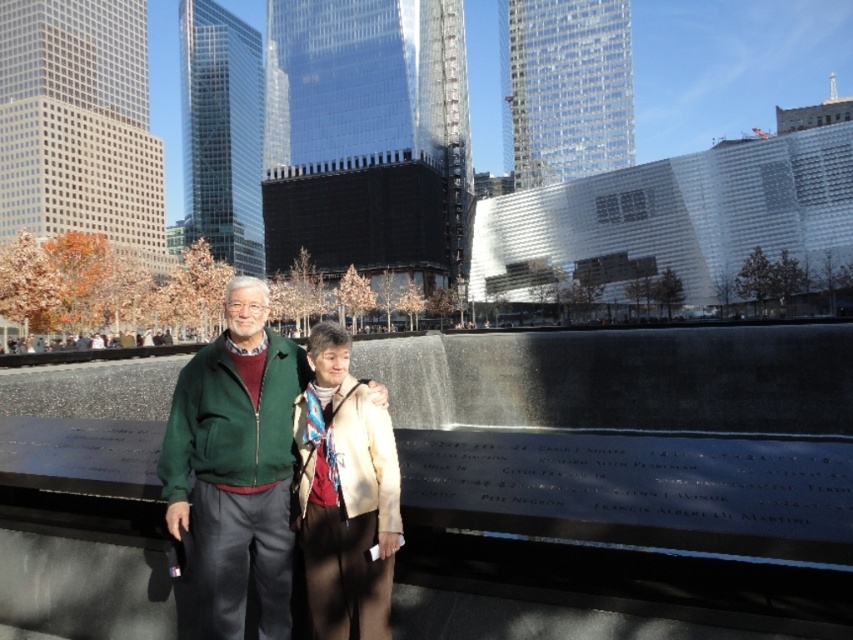
What do you see at coordinates (236, 465) in the screenshot?
I see `green fleece jacket at center` at bounding box center [236, 465].

Is green fleece jacket at center smaller than beige textured jacket at center?

No.

Where is `green fleece jacket at center`? The image size is (853, 640). green fleece jacket at center is located at coordinates (236, 465).

This screenshot has width=853, height=640. In order to click on green fleece jacket at center in this screenshot , I will do `click(236, 465)`.